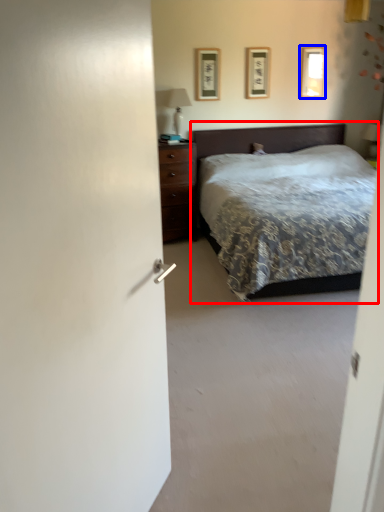
Question: Which of the following is the closest to the observer, bed (highlighted by a red box) or picture frame (highlighted by a blue box)?

Choices:
 (A) bed
 (B) picture frame

Answer: (A)